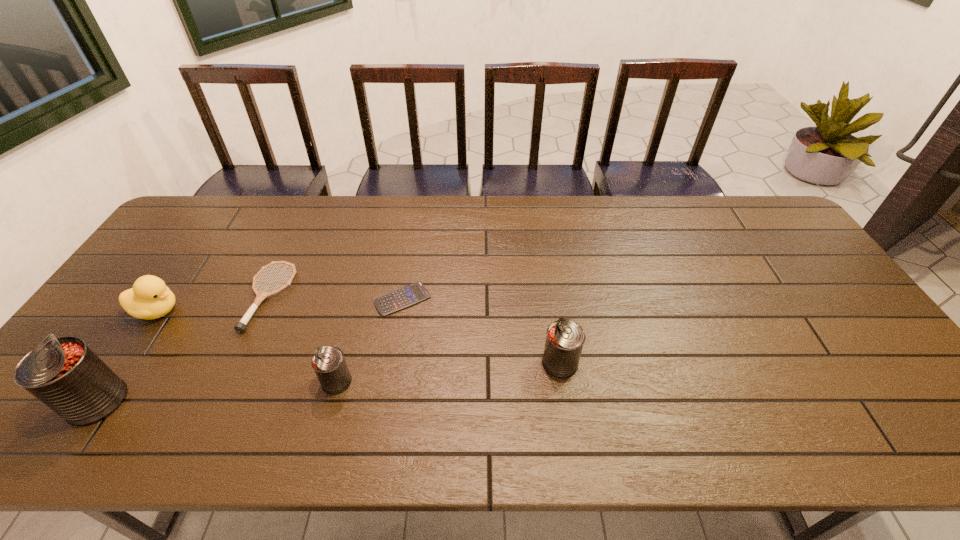
At what (x,y) coordinates should I click in order to perform the action: click on the tallest object. Please return your answer as a coordinate pair (x, y). This screenshot has height=540, width=960. Looking at the image, I should click on (64, 373).

Image resolution: width=960 pixels, height=540 pixels. I want to click on the leftmost can, so click(x=64, y=373).

What are the coordinates of `the second can from left to right` in the screenshot? It's located at tap(329, 364).

I want to click on the fourth object from left to right, so click(x=329, y=364).

Find the location of `the rightmost object`. the rightmost object is located at coordinates (565, 338).

I want to click on the second tallest can, so (x=565, y=338).

Where is `tennis racket`? The height and width of the screenshot is (540, 960). tennis racket is located at coordinates (240, 326).

Identify the location of the fifth tallest object. The height and width of the screenshot is (540, 960). (240, 326).

Where is `the shortest object`? Image resolution: width=960 pixels, height=540 pixels. the shortest object is located at coordinates (406, 296).

Image resolution: width=960 pixels, height=540 pixels. In order to click on calculator in this screenshot , I will do `click(406, 296)`.